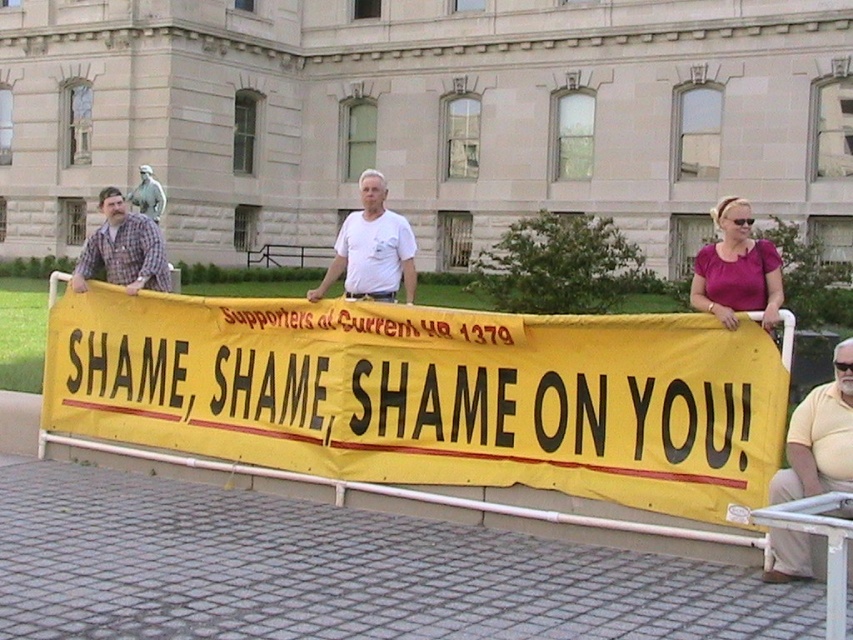
Which is above, yellow fabric banner at center or purple satin blouse at upper right?

purple satin blouse at upper right is higher up.

Is point (207, 429) positioned behind point (734, 296)?

Yes, it is.

You are a GUI agent. You are given a task and a screenshot of the screen. Output one action in this format:
    pyautogui.click(x=<x>, y=<y>)
    Task: Click on the yellow fabric banner at center
    This screenshot has height=640, width=853.
    Given the screenshot: What is the action you would take?
    pyautogui.click(x=430, y=394)

Can you confirm if yellow fabric banner at center is positioned above yellow t-shirt at center?

Yes, yellow fabric banner at center is above yellow t-shirt at center.

Can you confirm if yellow fabric banner at center is positioned to the left of yellow t-shirt at center?

Yes, yellow fabric banner at center is to the left of yellow t-shirt at center.

Is point (173, 396) closer to camera compared to point (849, 442)?

No, it is not.

The image size is (853, 640). What are the coordinates of `yellow fabric banner at center` in the screenshot? It's located at (430, 394).

Who is positioned more to the right, yellow t-shirt at center or purple satin blouse at upper right?

purple satin blouse at upper right is more to the right.

Is point (850, 486) behind point (722, 262)?

That is False.

Is point (772, 532) positioned behind point (705, 305)?

No, it is in front of (705, 305).

Image resolution: width=853 pixels, height=640 pixels. In order to click on yellow t-shirt at center in this screenshot , I will do `click(819, 436)`.